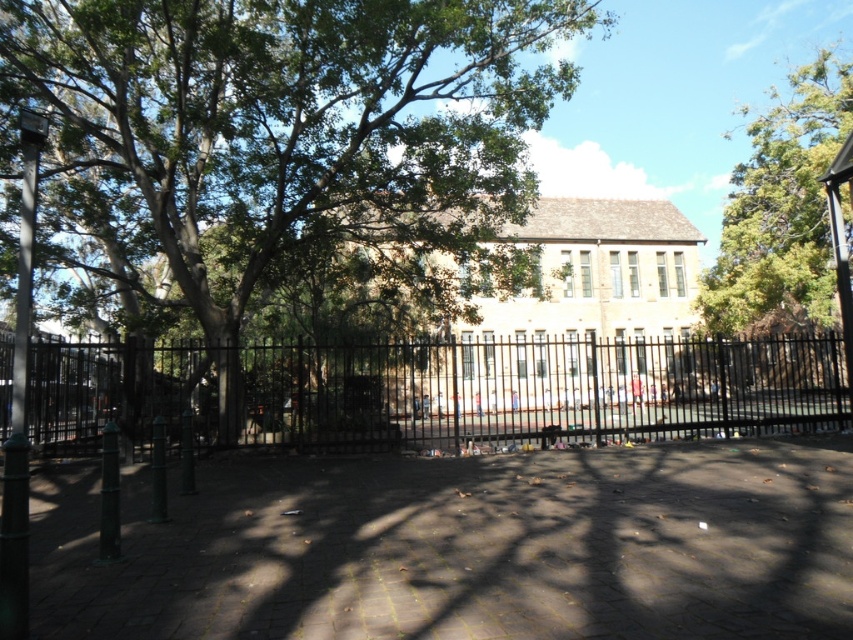
Does green leafy tree at center come behind black metal fence at center?

No, green leafy tree at center is in front of black metal fence at center.

Who is more forward, [498,97] or [465,380]?

Positioned in front is point [498,97].

Find the location of `green leafy tree at center`. green leafy tree at center is located at coordinates (280, 136).

Does black metal fence at center have a larger size compared to green leafy tree at upper right?

No, black metal fence at center is not bigger than green leafy tree at upper right.

Is black metal fence at center wider than green leafy tree at upper right?

In fact, black metal fence at center might be narrower than green leafy tree at upper right.

Which is in front, point (767, 388) or point (804, 97)?

Point (804, 97) is in front.

This screenshot has height=640, width=853. I want to click on black metal fence at center, so click(x=434, y=390).

You are a GUI agent. You are given a task and a screenshot of the screen. Output one action in this format:
    pyautogui.click(x=<x>, y=<y>)
    Task: Click on the green leafy tree at center
    The width and height of the screenshot is (853, 640).
    Given the screenshot: What is the action you would take?
    pyautogui.click(x=280, y=136)

Consider the image. Can you confirm if green leafy tree at center is positioned to the left of green leafy tree at upper right?

Indeed, green leafy tree at center is positioned on the left side of green leafy tree at upper right.

Does point (512, 161) lie behind point (798, 276)?

No, (512, 161) is in front of (798, 276).

The image size is (853, 640). Identify the location of green leafy tree at center. (280, 136).